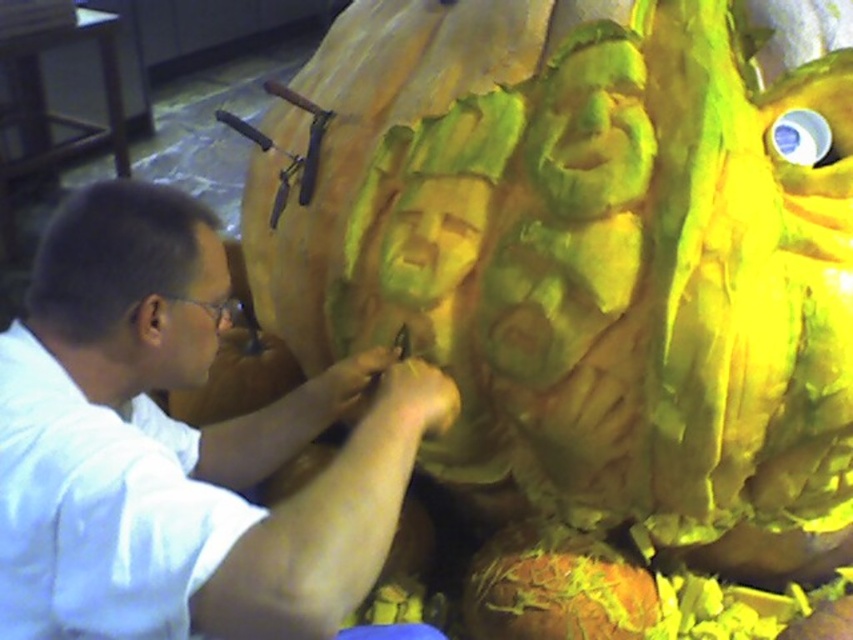
You are a safety inspector checking the workspace. The white matte shirt at center is located at point 0.698, 0.210. Is the shirt positioned within the recommended safety zone for operating carving tools? Please provide your assessment based on standard safety guidelines which require the shirt to be within the central 0.5x0.5 area of the workspace.

The white matte shirt at center is located at point [178,445]. According to standard safety guidelines, the shirt must be within the central 0.5x0.5 area of the workspace. Since 0.698 exceeds the 0.5 threshold in the x coordinate, the shirt is positioned outside the recommended safety zone.